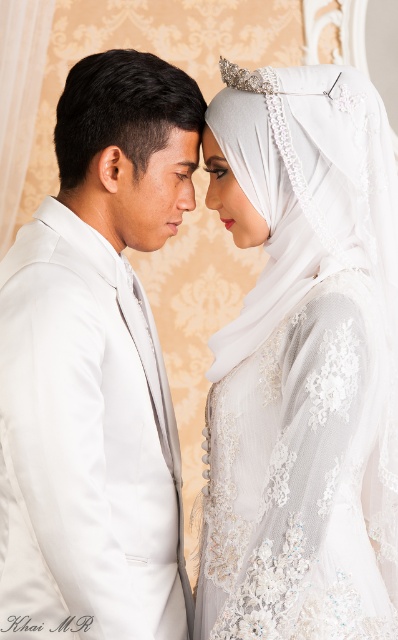
Is the position of matte white suit at left more distant than that of matte skin forehead at center?

No, matte white suit at left is in front of matte skin forehead at center.

Can you confirm if matte white suit at left is bigger than matte skin forehead at center?

Yes.

At what (x,y) coordinates should I click in order to perform the action: click on matte white suit at left. Please return your answer as a coordinate pair (x, y). The height and width of the screenshot is (640, 398). Looking at the image, I should click on (95, 371).

Between point (376, 579) and point (187, 131), which one is positioned behind?

Point (187, 131)

How far apart are white lace hijab at upper center and matte skin forehead at center?

white lace hijab at upper center is 48.88 centimeters away from matte skin forehead at center.

Locate an element on the screen. The image size is (398, 640). white lace hijab at upper center is located at coordinates (302, 364).

Is point (277, 205) positioned in front of point (152, 632)?

No.

Which of these two, white lace hijab at upper center or matte white suit at left, stands taller?

white lace hijab at upper center

Is point (343, 81) closer to camera compared to point (161, 228)?

Yes, point (343, 81) is in front of point (161, 228).

The width and height of the screenshot is (398, 640). Find the location of `white lace hijab at upper center`. white lace hijab at upper center is located at coordinates (302, 364).